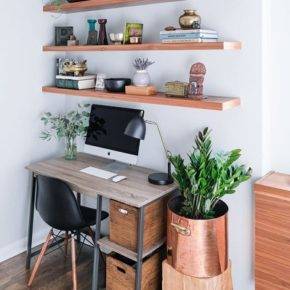
Find the location of a particular element. chair leg is located at coordinates (72, 250).